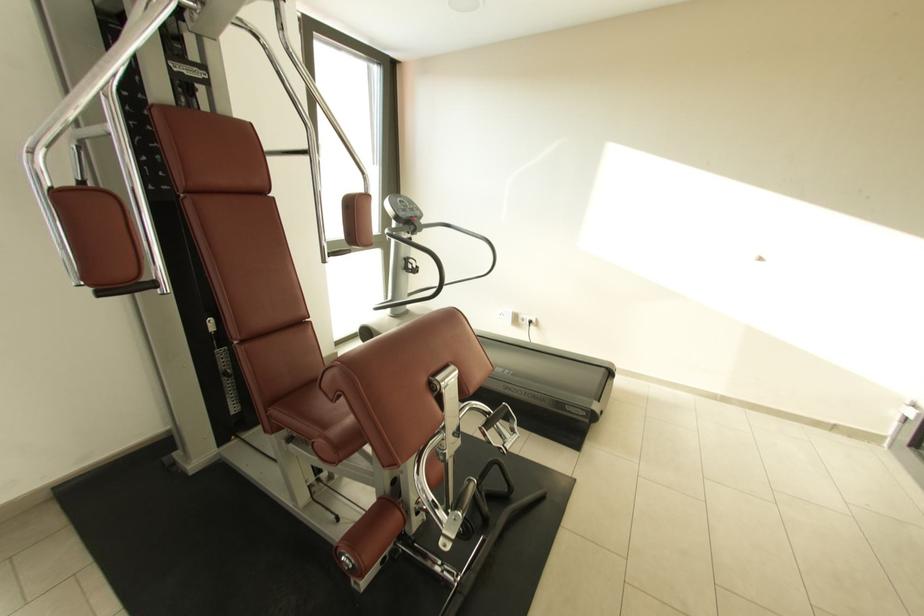
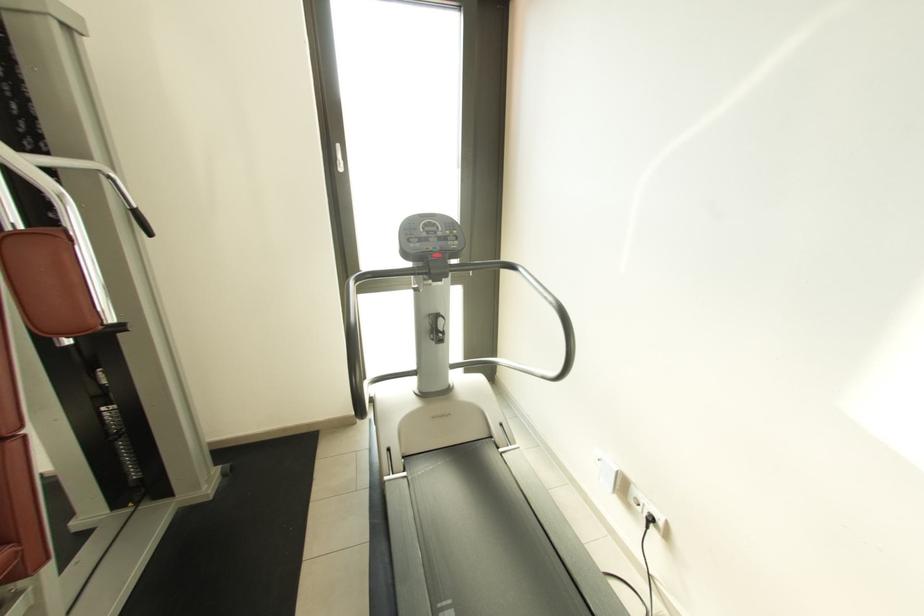
Locate, in the second image, the point that corresponds to pixel 407 265 in the first image.

(432, 325)